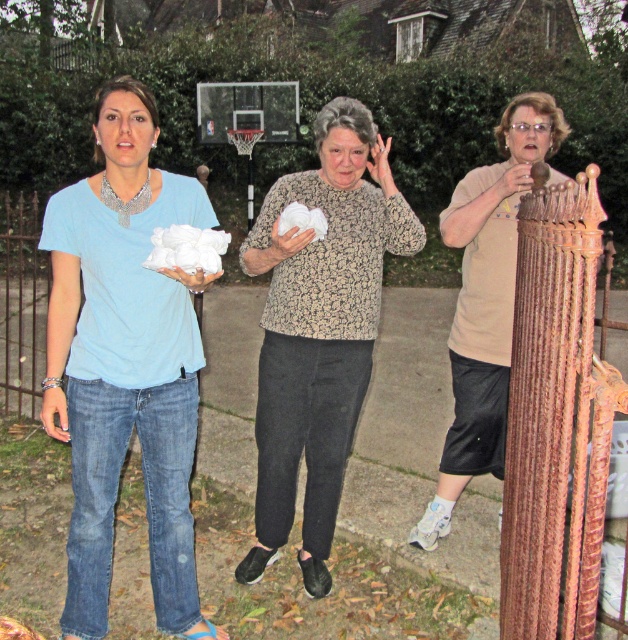
Question: Which of the following is the farthest from the observer?

Choices:
 (A) matte blue shirt at center
 (B) beige matte shirt at right
 (C) white textured sweater at center

Answer: (B)

Question: Can you confirm if white textured sweater at center is thinner than beige matte shirt at right?

Choices:
 (A) no
 (B) yes

Answer: (A)

Question: Does white textured sweater at center appear on the left side of beige matte shirt at right?

Choices:
 (A) yes
 (B) no

Answer: (A)

Question: Among these objects, which one is farthest from the camera?

Choices:
 (A) white textured sweater at center
 (B) matte blue shirt at center

Answer: (A)

Question: Among these points, which one is nearest to the camera?

Choices:
 (A) (268, 324)
 (B) (158, 205)
 (C) (480, 371)

Answer: (B)

Question: Does matte blue shirt at center have a greater width compared to white textured sweater at center?

Choices:
 (A) no
 (B) yes

Answer: (A)